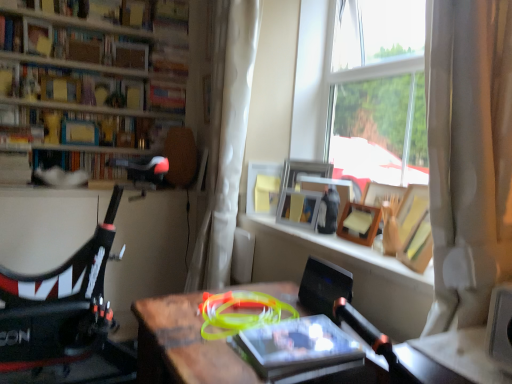
Identify the location of vacant point above wooden desk at center (from a real-world perspective). (238, 317).